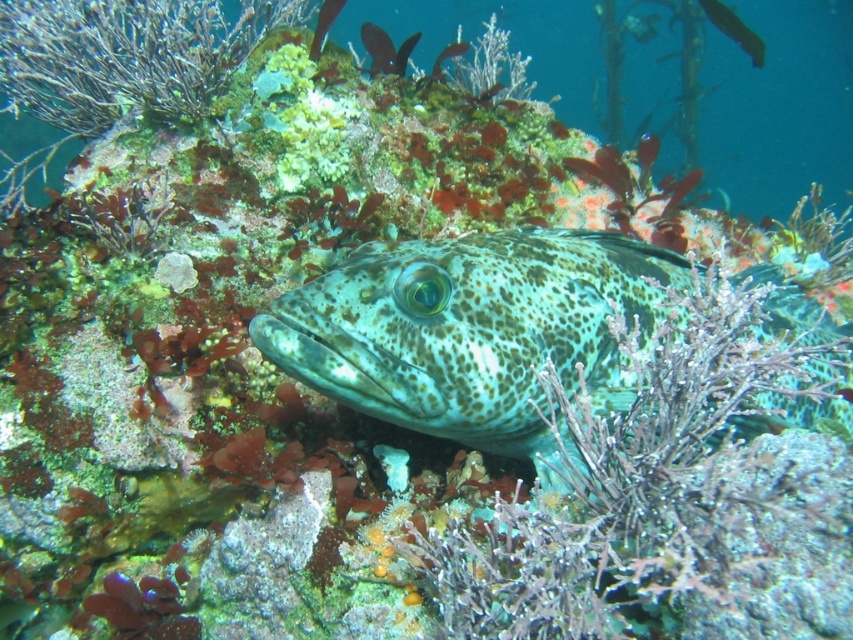
You are a marine biologist studying underwater life. You observe a point at coordinates (x=386, y=49) in the image. Based on the scene, which object does this point belong to?

The point at coordinates (x=386, y=49) belongs to the spotted green fish at upper center.

You are a marine biologist observing the underwater scene. You notice two fish, the spotted green fish at upper center and the speckled green fish at center. Which fish is positioned closer to you?

The spotted green fish at upper center is closer to the viewer than the speckled green fish at center.